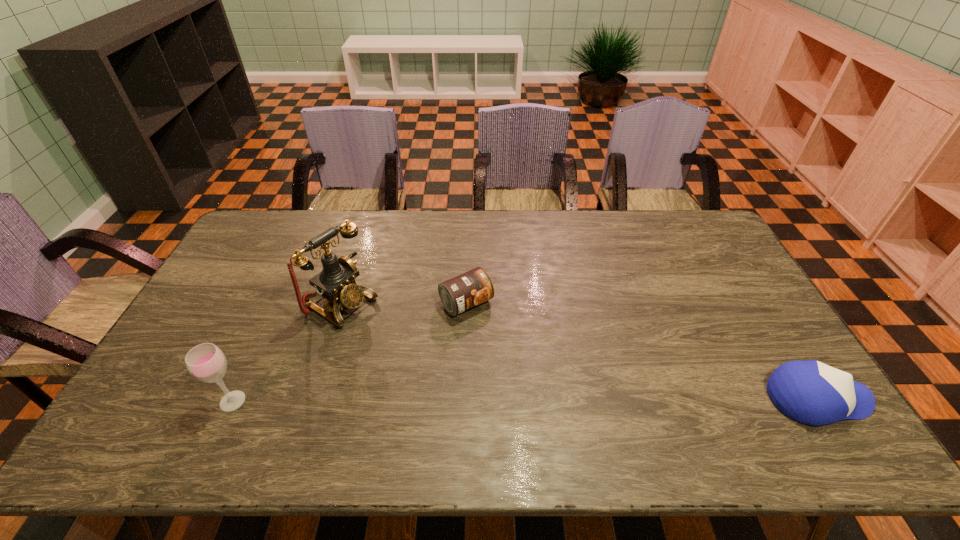
Locate an element on the screen. free spot on the desktop that is between the second tallest object and the baseball cap and is positioned on the front label of the can is located at coordinates (549, 400).

At what (x,y) coordinates should I click in order to perform the action: click on free space on the desktop that is between the leftmost object and the rightmost object and is positioned on the front of the second object from left to right, featuring the rotary dial. Please return your answer as a coordinate pair (x, y). Looking at the image, I should click on (495, 400).